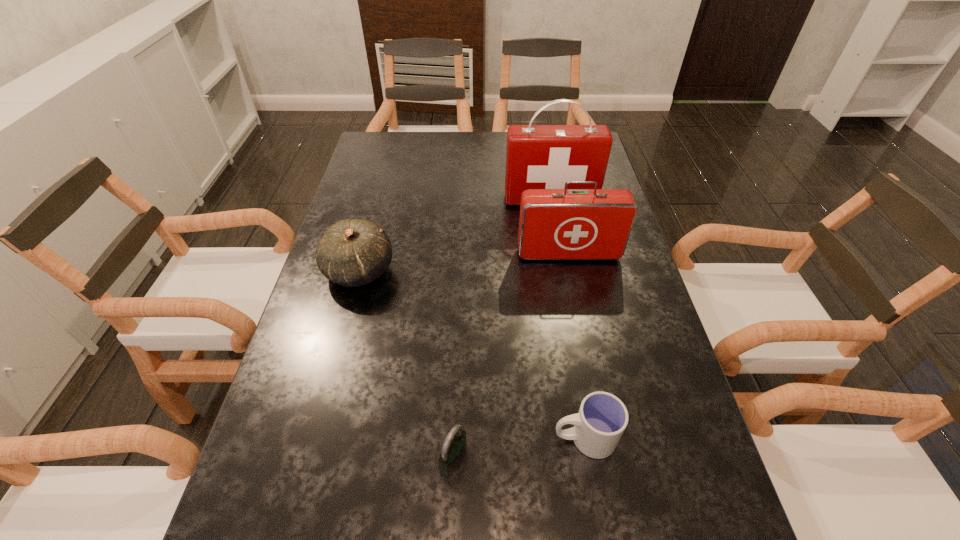
At what (x,y) coordinates should I click in order to perform the action: click on vacant area located on the front of the gourd. Please return your answer as a coordinate pair (x, y). Image resolution: width=960 pixels, height=540 pixels. Looking at the image, I should click on (325, 399).

Where is `vacant region located 0.290m on the back of the padlock`? This screenshot has width=960, height=540. vacant region located 0.290m on the back of the padlock is located at coordinates (460, 321).

Find the location of a particular element. vacant space located 0.260m with the handle on the side of the cup is located at coordinates (416, 437).

The height and width of the screenshot is (540, 960). Find the location of `blank space located 0.240m with the handle on the side of the cup`. blank space located 0.240m with the handle on the side of the cup is located at coordinates (426, 437).

At what (x,y) coordinates should I click in order to perform the action: click on vacant space situated 0.340m with the handle on the side of the cup. Please return your answer as a coordinate pair (x, y). Looking at the image, I should click on (373, 437).

Locate an element on the screen. object positioned at the left edge is located at coordinates (353, 252).

I want to click on cup located at the right edge, so click(x=602, y=418).

Image resolution: width=960 pixels, height=540 pixels. In the image, there is a desktop. Find the location of `vacant space at the far edge`. vacant space at the far edge is located at coordinates (410, 161).

You are a GUI agent. You are given a task and a screenshot of the screen. Output one action in this format:
    pyautogui.click(x=<x>, y=<y>)
    Task: Click on the vacant position at the left edge of the desktop
    The width and height of the screenshot is (960, 540).
    Given the screenshot: What is the action you would take?
    pyautogui.click(x=301, y=514)

Identify the location of vacant space at the right edge of the desktop. Image resolution: width=960 pixels, height=540 pixels. (621, 461).